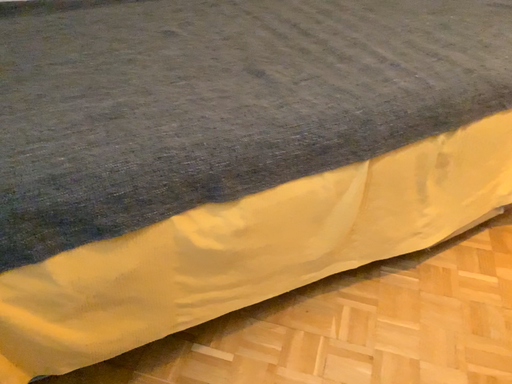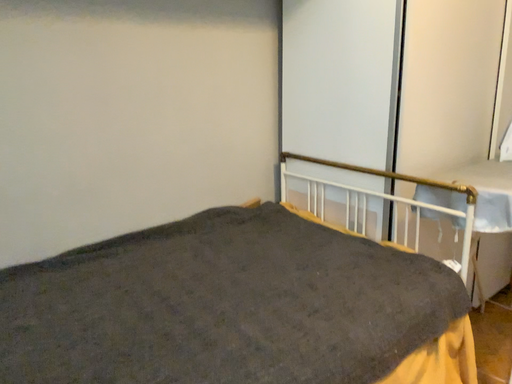
Question: How did the camera likely rotate when shooting the video?

Choices:
 (A) rotated upward
 (B) rotated downward

Answer: (A)